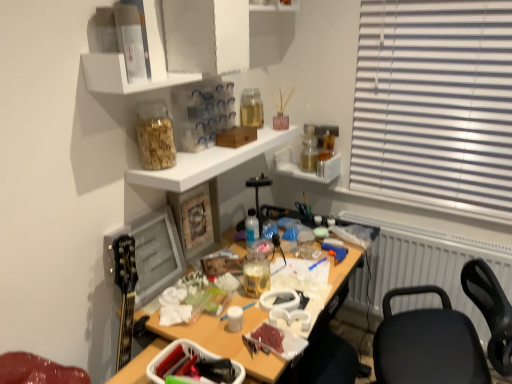
Find the location of a particular element. The image size is (512, 384). vacant space to the right of translucent glass jar at upper center, the 2th bottle from the bottom is located at coordinates (197, 157).